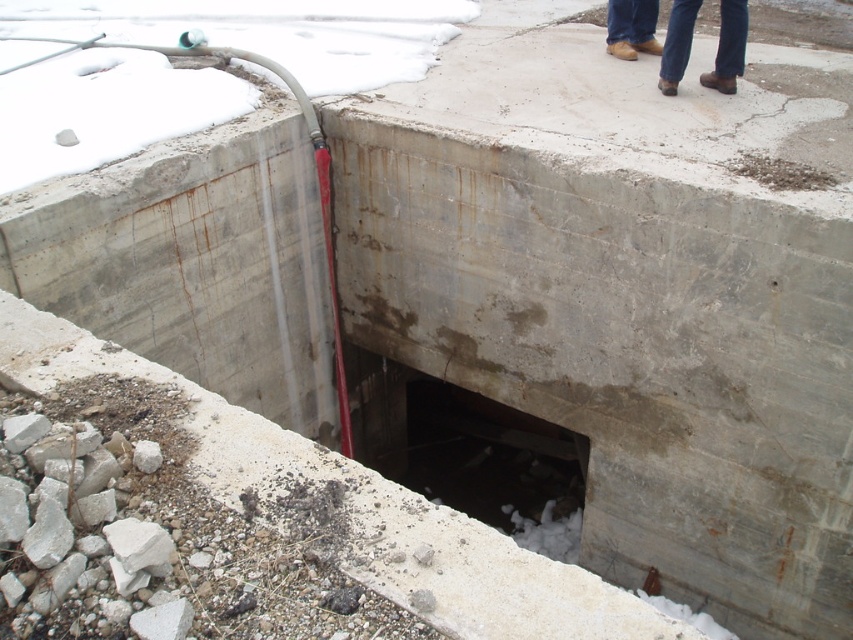
Can you confirm if dark concrete hole at center is thinner than brown leather shoes at upper right?

Incorrect, dark concrete hole at center's width is not less than brown leather shoes at upper right's.

Which is more to the right, dark concrete hole at center or brown leather shoes at upper right?

brown leather shoes at upper right is more to the right.

Does point (363, 451) come farther from viewer compared to point (618, 49)?

Yes, it is behind point (618, 49).

In order to click on dark concrete hole at center in this screenshot , I will do `click(468, 452)`.

Is brown leather shoes at upper center closer to the viewer compared to brown leather shoes at upper right?

Yes, it is in front of brown leather shoes at upper right.

The width and height of the screenshot is (853, 640). Describe the element at coordinates (728, 48) in the screenshot. I see `brown leather shoes at upper center` at that location.

You are a GUI agent. You are given a task and a screenshot of the screen. Output one action in this format:
    pyautogui.click(x=<x>, y=<y>)
    Task: Click on the brown leather shoes at upper center
    The image size is (853, 640).
    Given the screenshot: What is the action you would take?
    pyautogui.click(x=728, y=48)

Is dark concrete hole at center to the left of brown leather shoes at upper center from the viewer's perspective?

Indeed, dark concrete hole at center is positioned on the left side of brown leather shoes at upper center.

Who is more forward, (451,452) or (691,1)?

Point (691,1)

Does point (585, 444) come closer to viewer compared to point (740, 28)?

No, it is behind (740, 28).

Find the location of a particular element. dark concrete hole at center is located at coordinates (468, 452).